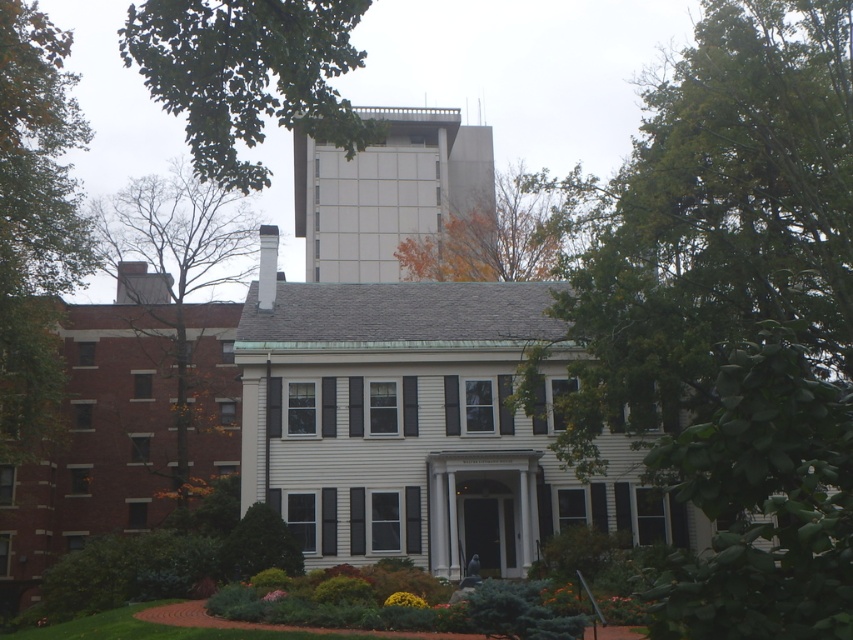
The width and height of the screenshot is (853, 640). Describe the element at coordinates (33, 220) in the screenshot. I see `green leafy tree at left` at that location.

Find the location of `green leafy tree at left`. green leafy tree at left is located at coordinates (33, 220).

Can you confirm if green leafy tree at left is wider than green leafy tree at upper left?

In fact, green leafy tree at left might be narrower than green leafy tree at upper left.

Who is shorter, green leafy tree at left or green leafy tree at upper left?

With less height is green leafy tree at left.

Who is more forward, (3, 307) or (99, 243)?

Point (3, 307) is more forward.

At what (x,y) coordinates should I click in order to perform the action: click on green leafy tree at left. Please return your answer as a coordinate pair (x, y). The image size is (853, 640). Looking at the image, I should click on (33, 220).

Between green leafy tree at upper left and white smooth chimney at upper center, which one appears on the left side from the viewer's perspective?

Positioned to the left is green leafy tree at upper left.

Between point (183, 458) and point (265, 289), which one is positioned in front?

Point (265, 289)

Where is `green leafy tree at upper left`? green leafy tree at upper left is located at coordinates (177, 252).

Where is `green leafy tree at upper left`? The width and height of the screenshot is (853, 640). green leafy tree at upper left is located at coordinates (177, 252).